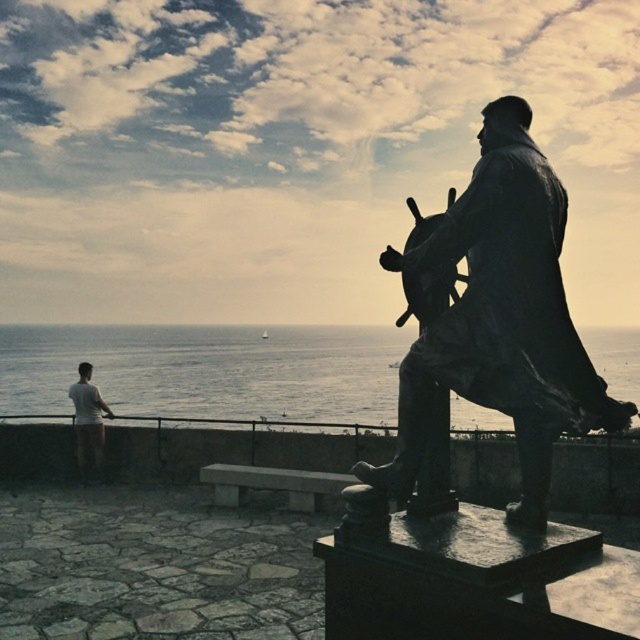
Which is more to the right, silvery water at lower left or white cotton shorts at lower left?

From the viewer's perspective, silvery water at lower left appears more on the right side.

Does silvery water at lower left appear on the left side of white cotton shorts at lower left?

No, silvery water at lower left is not to the left of white cotton shorts at lower left.

I want to click on silvery water at lower left, so click(x=209, y=369).

This screenshot has width=640, height=640. What are the coordinates of `silvery water at lower left` in the screenshot? It's located at (209, 369).

Between point (406, 289) and point (81, 444), which one is positioned in front?

Positioned in front is point (406, 289).

Who is positioned more to the left, shiny metal gun at center or white cotton shorts at lower left?

From the viewer's perspective, white cotton shorts at lower left appears more on the left side.

What do you see at coordinates (429, 292) in the screenshot? The width and height of the screenshot is (640, 640). I see `shiny metal gun at center` at bounding box center [429, 292].

The width and height of the screenshot is (640, 640). What are the coordinates of `shiny metal gun at center` in the screenshot? It's located at (429, 292).

You are a GUI agent. You are given a task and a screenshot of the screen. Output one action in this format:
    pyautogui.click(x=<x>, y=<y>)
    Task: Click on the bronze ship captain at right
    This screenshot has height=640, width=640.
    Given the screenshot: What is the action you would take?
    coord(500,317)

Is bronze ship captain at right above shiny metal gun at center?

No.

This screenshot has width=640, height=640. I want to click on bronze ship captain at right, so click(500, 317).

Where is `bronze ship captain at right`? The height and width of the screenshot is (640, 640). bronze ship captain at right is located at coordinates (500, 317).